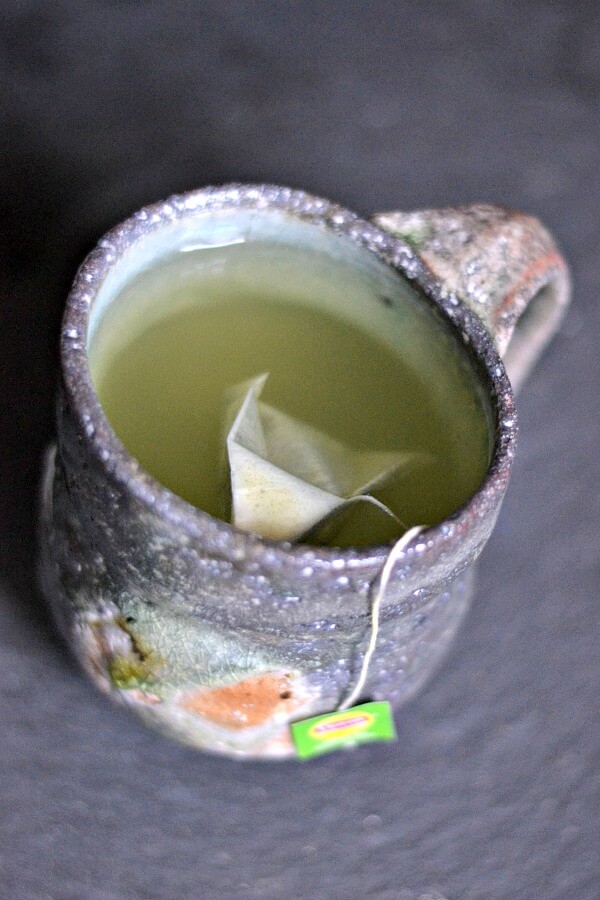
Where is `table`? This screenshot has height=900, width=600. table is located at coordinates (544, 630).